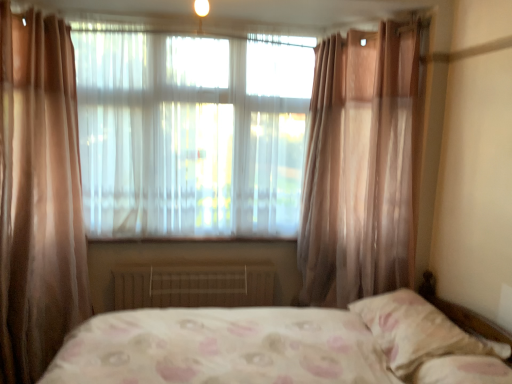
Measure the distance between point (158, 156) and camera.

The depth of point (158, 156) is 2.76 meters.

This screenshot has height=384, width=512. Identify the location of sheer pink curtain at right. (361, 166).

Can you confirm if sheer pink curtain at right is bigger than metallic radiator at center?

Yes, sheer pink curtain at right is bigger than metallic radiator at center.

From the image's perspective, is sheer pink curtain at right above or below metallic radiator at center?

From the image's perspective, sheer pink curtain at right appears above metallic radiator at center.

Does sheer pink curtain at right lie behind metallic radiator at center?

No.

Is translucent fabric window at center oriented away from white floral fabric pillow at lower right?

translucent fabric window at center does not have its back to white floral fabric pillow at lower right.

How many degrees apart are the facing directions of translucent fabric window at center and white floral fabric pillow at lower right?

90.4 degrees separate the facing orientations of translucent fabric window at center and white floral fabric pillow at lower right.

From the image's perspective, is translucent fabric window at center on white floral fabric pillow at lower right?

Yes.

Which of these two, sheer pink curtain at right or white floral fabric pillow at lower right, stands taller?

With more height is sheer pink curtain at right.

Considering their positions, is sheer pink curtain at right located in front of or behind white floral fabric pillow at lower right?

Visually, sheer pink curtain at right is located behind white floral fabric pillow at lower right.

From the image's perspective, is sheer pink curtain at right above or below white floral fabric pillow at lower right?

From the image's perspective, sheer pink curtain at right appears above white floral fabric pillow at lower right.

Who is smaller, white floral fabric pillow at lower right or metallic radiator at center?

metallic radiator at center is smaller.

Is white floral fabric pillow at lower right not inside metallic radiator at center?

Indeed, white floral fabric pillow at lower right is completely outside metallic radiator at center.

Is white floral fabric pillow at lower right wider than metallic radiator at center?

Indeed, white floral fabric pillow at lower right has a greater width compared to metallic radiator at center.

From the image's perspective, between matte white light at upper center and sheer pink curtain at right, which one is located above?

matte white light at upper center.

Would you say matte white light at upper center is outside sheer pink curtain at right?

matte white light at upper center lies outside sheer pink curtain at right's area.

Identify the location of curtain behind the matte white light at upper center. Image resolution: width=512 pixels, height=384 pixels. (361, 166).

Consider the image. Is translucent fabric window at center to the right of matte white light at upper center from the viewer's perspective?

In fact, translucent fabric window at center is to the left of matte white light at upper center.

Identify the location of window lying behind the matte white light at upper center. (192, 134).

Is point (257, 100) farther from viewer compared to point (196, 13)?

That is True.

Is matte white light at upper center surrounded by translucent fabric window at center?

No, matte white light at upper center is not inside translucent fabric window at center.

Measure the distance from metallic radiator at center to white floral fabric pillow at lower right.

metallic radiator at center is 3.71 feet from white floral fabric pillow at lower right.

Between metallic radiator at center and white floral fabric pillow at lower right, which one has more height?

metallic radiator at center is taller.

Is metallic radiator at center placed right next to white floral fabric pillow at lower right?

metallic radiator at center and white floral fabric pillow at lower right are clearly separated.

This screenshot has width=512, height=384. I want to click on radiator below the sheer pink curtain at right (from the image's perspective), so click(x=193, y=285).

Image resolution: width=512 pixels, height=384 pixels. Find the location of `pillow that is in front of the translucent fabric window at center`. pillow that is in front of the translucent fabric window at center is located at coordinates (414, 331).

Based on their spatial positions, is translucent fabric window at center or matte white light at upper center closer to white floral fabric pillow at lower right?

translucent fabric window at center.

When comparing their distances from translucent fabric window at center, does metallic radiator at center or white floral fabric pillow at lower right seem closer?

metallic radiator at center.

Estimate the real-world distances between objects in this image. Which object is closer to white floral fabric pillow at lower right, sheer pink curtain at right or translucent fabric window at center?

Among the two, sheer pink curtain at right is located nearer to white floral fabric pillow at lower right.

In the scene shown: Which object lies nearer to the anchor point translucent fabric window at center, metallic radiator at center or sheer pink curtain at right?

Based on the image, sheer pink curtain at right appears to be nearer to translucent fabric window at center.

When comparing their distances from metallic radiator at center, does sheer pink curtain at right or translucent fabric window at center seem further?

Among the two, sheer pink curtain at right is located further to metallic radiator at center.

Based on their spatial positions, is translucent fabric window at center or metallic radiator at center further from sheer pink curtain at right?

Among the two, metallic radiator at center is located further to sheer pink curtain at right.

Based on their spatial positions, is sheer pink curtain at right or white floral fabric pillow at lower right closer to metallic radiator at center?

The object closer to metallic radiator at center is sheer pink curtain at right.

When comparing their distances from sheer pink curtain at right, does matte white light at upper center or metallic radiator at center seem closer?

metallic radiator at center is positioned closer to the anchor sheer pink curtain at right.

The image size is (512, 384). What are the coordinates of `curtain between matte white light at upper center and white floral fabric pillow at lower right vertically` in the screenshot? It's located at [x=361, y=166].

The width and height of the screenshot is (512, 384). I want to click on curtain that lies between matte white light at upper center and metallic radiator at center from top to bottom, so click(x=361, y=166).

Where is `pillow between matte white light at upper center and metallic radiator at center in the vertical direction`? The height and width of the screenshot is (384, 512). pillow between matte white light at upper center and metallic radiator at center in the vertical direction is located at coordinates (414, 331).

Where is `window between metallic radiator at center and sheer pink curtain at right`? This screenshot has width=512, height=384. window between metallic radiator at center and sheer pink curtain at right is located at coordinates (192, 134).